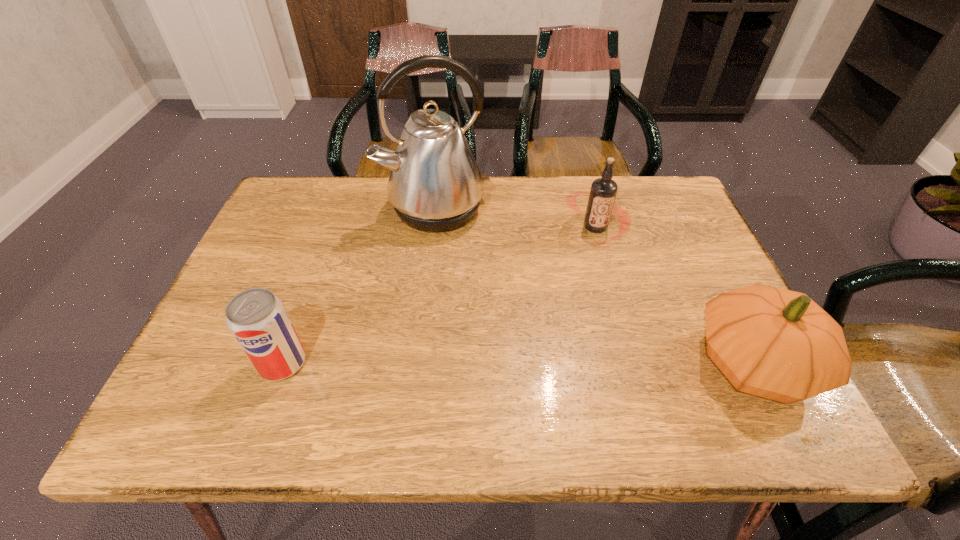
Image resolution: width=960 pixels, height=540 pixels. I want to click on vacant region located 0.390m from the spout of the tallest object, so click(514, 352).

At what (x,y) coordinates should I click in order to perform the action: click on vacant space positioned 0.400m from the spout of the tallest object. Please return your answer as a coordinate pair (x, y). This screenshot has width=960, height=540. Looking at the image, I should click on (516, 356).

Image resolution: width=960 pixels, height=540 pixels. What are the coordinates of `root beer at the far edge` in the screenshot? It's located at (603, 191).

Where is `kettle located in the far edge section of the desktop`? This screenshot has height=540, width=960. kettle located in the far edge section of the desktop is located at coordinates (435, 185).

Locate an element on the screen. The image size is (960, 540). soda at the near edge is located at coordinates click(256, 317).

The image size is (960, 540). I want to click on gourd that is at the near edge, so click(x=779, y=344).

What are the coordinates of `object that is at the left edge` in the screenshot? It's located at (256, 317).

Identify the location of object that is at the right edge. This screenshot has height=540, width=960. (779, 344).

Locate an element on the screen. object that is at the near left corner is located at coordinates [x=256, y=317].

The image size is (960, 540). In order to click on object present at the near right corner in this screenshot , I will do `click(779, 344)`.